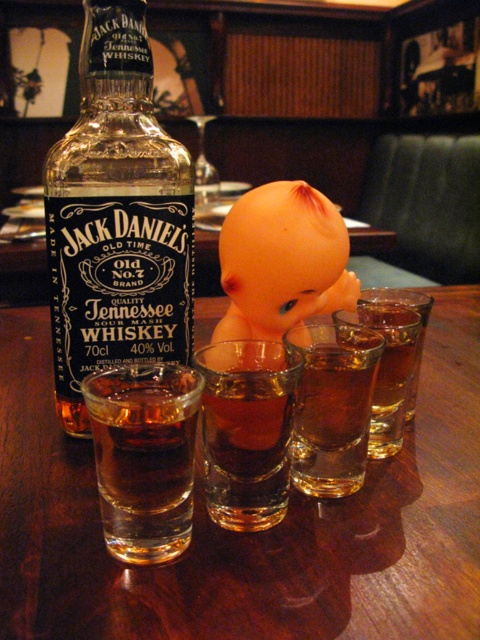
Consider the image. You are a bartender preparing a cocktail and need to place the matte orange baby doll at center and the amber liquid at center on the table. Which object requires more horizontal space?

The matte orange baby doll at center might be wider than the amber liquid at center, so it requires more horizontal space.

You are a photographer trying to capture the Jack Daniel bottle from the perspective of the camera. Which of the two points, point (x=32, y=416) or point (x=365, y=298), is closer to the camera?

Point (x=32, y=416) is closer to the camera than point (x=365, y=298).

You are a bartender who needs to reach the translucent glass bottle at left from your current position. The bar counter is 1.2 meters long. Can you comfortably reach the bottle without moving your feet?

The distance between the translucent glass bottle at left and the camera is 36.66 centimeters. Since the bar counter is 1.2 meters long, which is 120 centimeters, the bottle is within a comfortable reaching distance for a bartender without needing to move their feet.